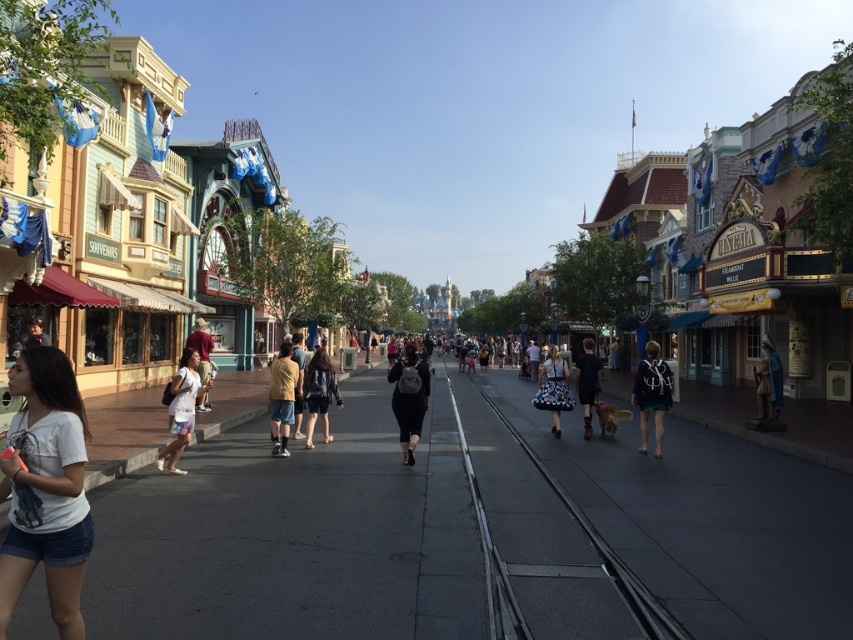
Question: Based on their relative distances, which object is farther from the gray concrete pavement at center?

Choices:
 (A) dotted floral skirt at center
 (B) white cotton dress at lower left
 (C) green matte skirt at center

Answer: (A)

Question: Is white cotton t-shirt at lower left to the right of matte black dress at center from the viewer's perspective?

Choices:
 (A) no
 (B) yes

Answer: (A)

Question: Does yellow matte shirt at center appear on the left side of denim jacket at center?

Choices:
 (A) yes
 (B) no

Answer: (A)

Question: Estimate the real-world distances between objects in this image. Which object is closer to the white cotton dress at lower left?

Choices:
 (A) white cotton t-shirt at lower left
 (B) dotted floral skirt at center
 (C) matte black dress at center

Answer: (A)

Question: Which point is farther to the camera?

Choices:
 (A) green matte skirt at center
 (B) yellow matte shirt at center
 (C) dotted floral skirt at center

Answer: (C)

Question: Does green matte skirt at center have a smaller size compared to matte black dress at center?

Choices:
 (A) yes
 (B) no

Answer: (A)